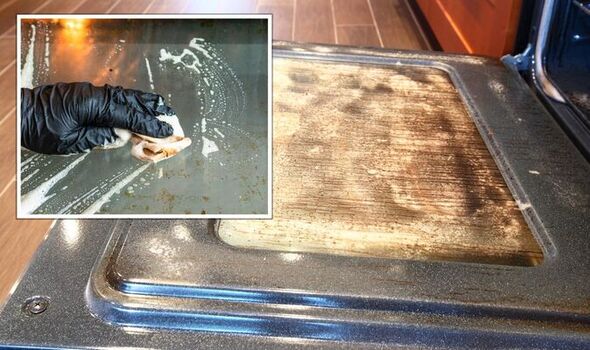
Identify the location of towel. The width and height of the screenshot is (590, 350). (166, 144).